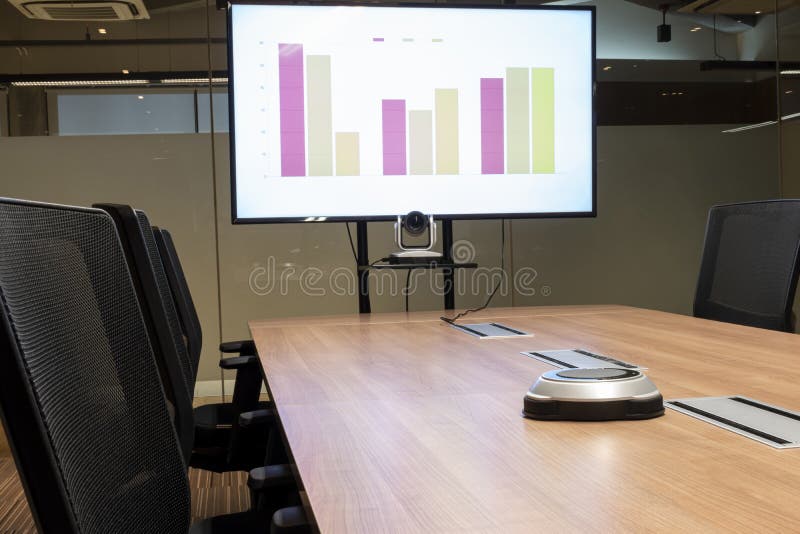
This screenshot has width=800, height=534. In order to click on speaker in this screenshot , I will do `click(562, 372)`.